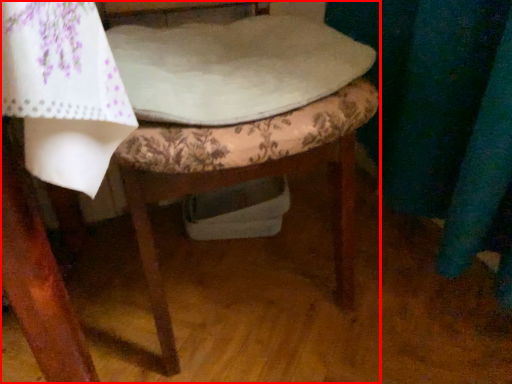
Question: From the image's perspective, considering the relative positions of chair (annotated by the red box) and sheet in the image provided, where is chair (annotated by the red box) located with respect to the staircase?

Choices:
 (A) above
 (B) below

Answer: (B)